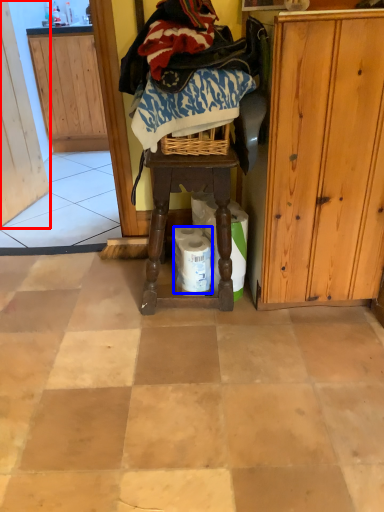
Question: Which point is closer to the camera, screen door (highlighted by a red box) or toilet paper (highlighted by a blue box)?

Choices:
 (A) screen door
 (B) toilet paper

Answer: (B)